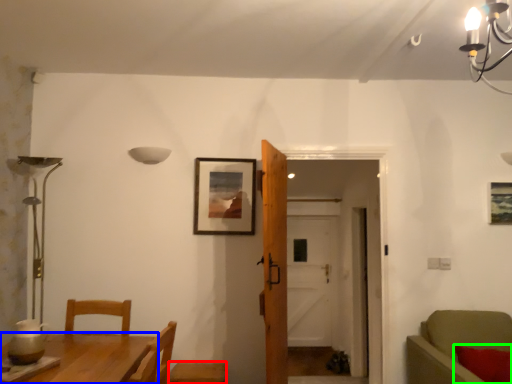
Question: Based on their relative distances, which object is nearer to armchair (highlighted by a red box)? Choose from table (highlighted by a blue box) and pillow (highlighted by a green box).

Choices:
 (A) table
 (B) pillow

Answer: (A)